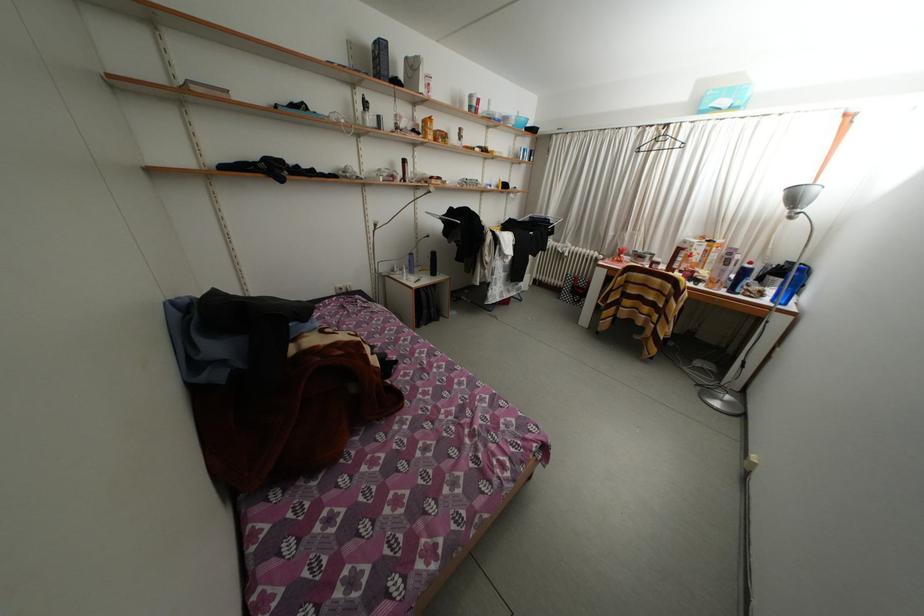
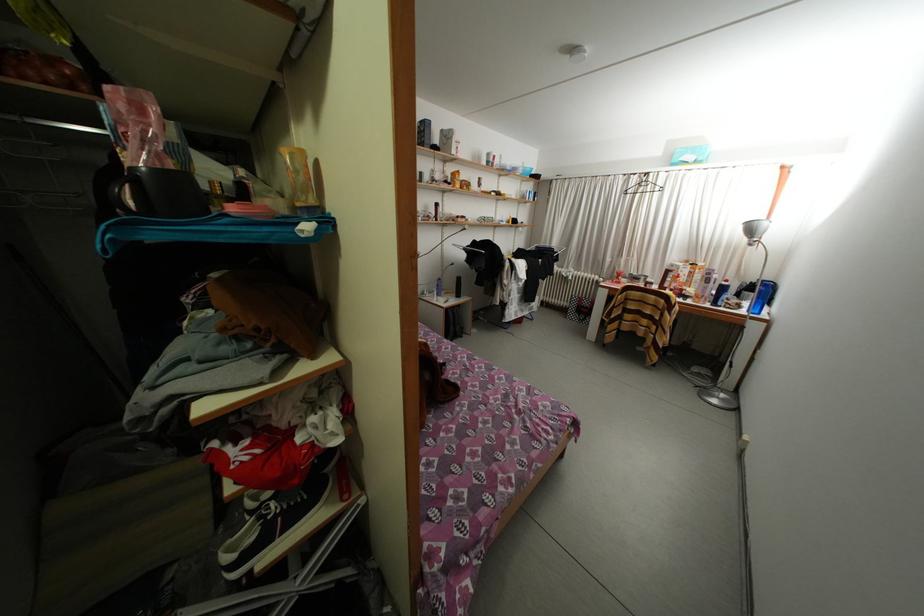
Where in the second image is the point corresponding to pixel 672 333 from the first image?

(670, 342)